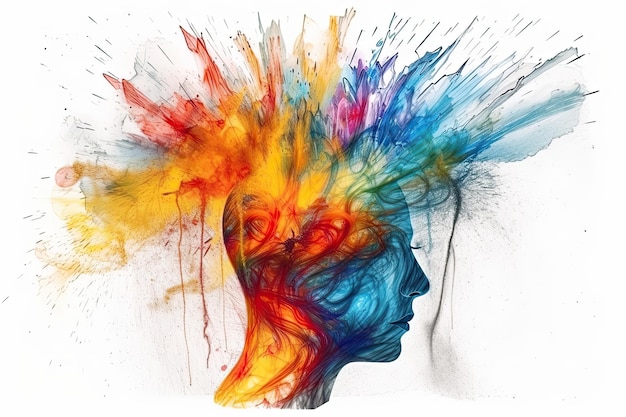
The width and height of the screenshot is (626, 417). I want to click on empty space around the painting, so point(131,328), point(526,351).